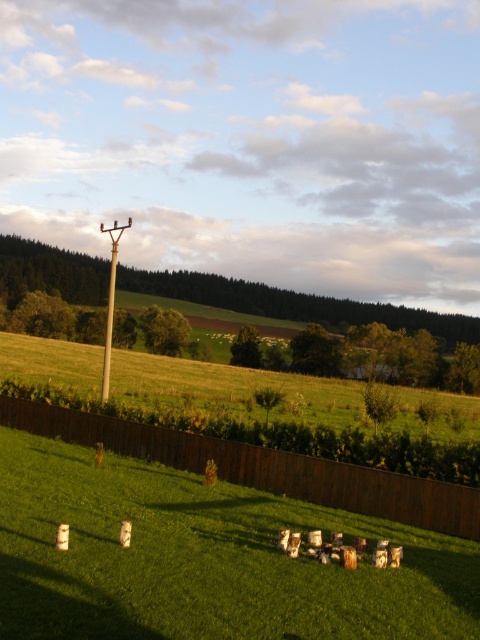
What do you see at coordinates (262, 467) in the screenshot? The height and width of the screenshot is (640, 480). I see `brown wooden fence at lower center` at bounding box center [262, 467].

The height and width of the screenshot is (640, 480). What do you see at coordinates (262, 467) in the screenshot?
I see `brown wooden fence at lower center` at bounding box center [262, 467].

This screenshot has height=640, width=480. Find the location of `brown wooden fence at lower center`. brown wooden fence at lower center is located at coordinates (262, 467).